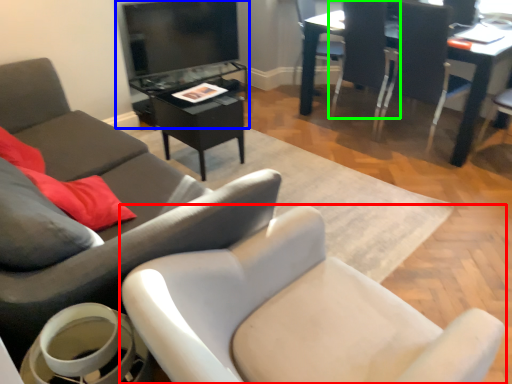
Question: Based on their relative distances, which object is farther from chair (highlighted by a red box)? Choose from entertainment center (highlighted by a blue box) and chair (highlighted by a green box).

Choices:
 (A) entertainment center
 (B) chair

Answer: (A)